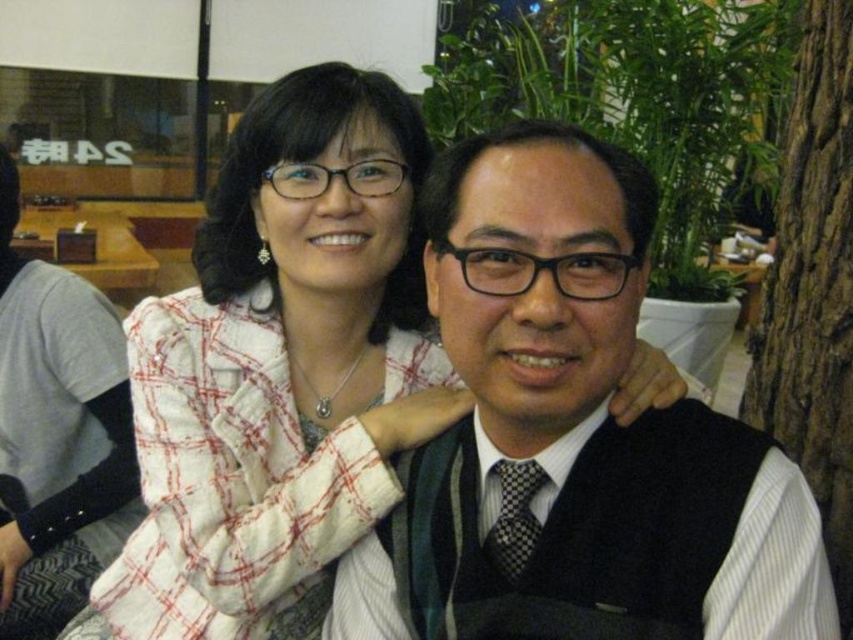
Is matte black vest at center bigger than white checkered jacket at upper center?

No, matte black vest at center is not bigger than white checkered jacket at upper center.

Which is more to the left, matte black vest at center or white checkered jacket at upper center?

From the viewer's perspective, white checkered jacket at upper center appears more on the left side.

The height and width of the screenshot is (640, 853). What do you see at coordinates (572, 436) in the screenshot? I see `matte black vest at center` at bounding box center [572, 436].

You are a GUI agent. You are given a task and a screenshot of the screen. Output one action in this format:
    pyautogui.click(x=<x>, y=<y>)
    Task: Click on the matte black vest at center
    This screenshot has width=853, height=640.
    Given the screenshot: What is the action you would take?
    pyautogui.click(x=572, y=436)

Is white checkered jacket at upper center to the right of brown rough bark at right from the viewer's perspective?

In fact, white checkered jacket at upper center is to the left of brown rough bark at right.

Between point (268, 595) and point (830, 97), which one is positioned behind?

The point (830, 97) is behind.

Find the location of a particular element. This screenshot has width=853, height=640. white checkered jacket at upper center is located at coordinates (280, 369).

Can you confirm if matte black vest at center is thinner than brown rough bark at right?

No, matte black vest at center is not thinner than brown rough bark at right.

Is the position of matte black vest at center less distant than that of brown rough bark at right?

That is True.

The height and width of the screenshot is (640, 853). What are the coordinates of `matte black vest at center` in the screenshot? It's located at (572, 436).